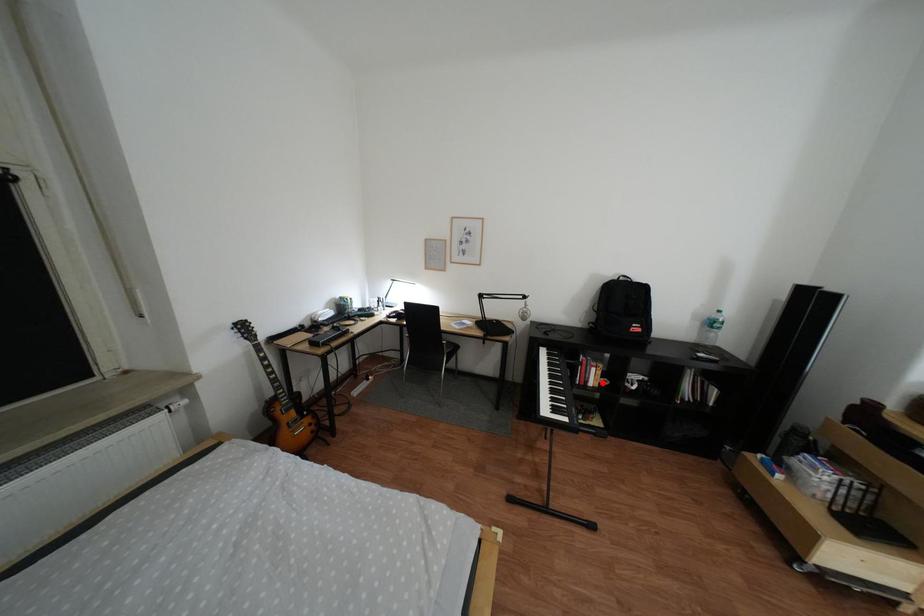
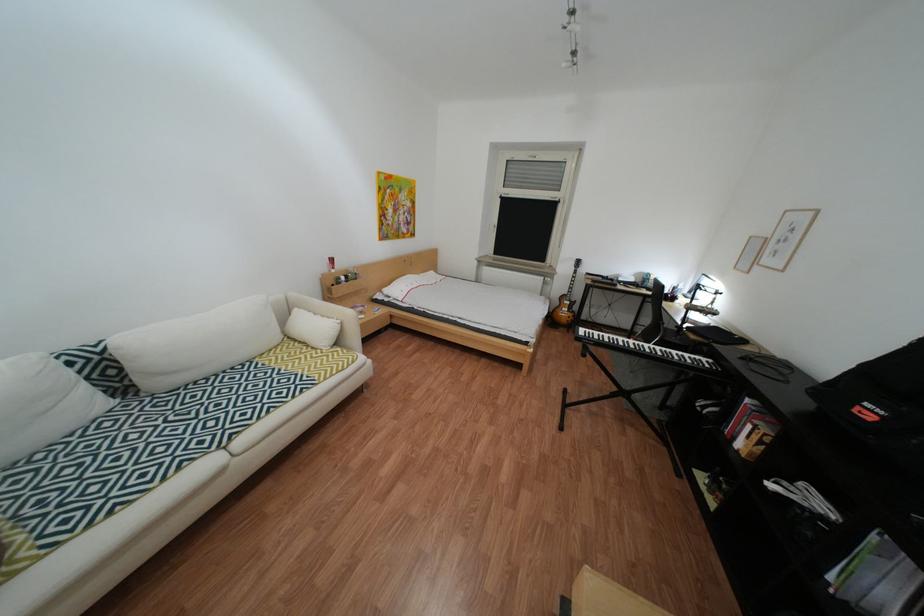
Locate, in the second image, the point that corresponds to the highlighted location in the first image.

(749, 439)